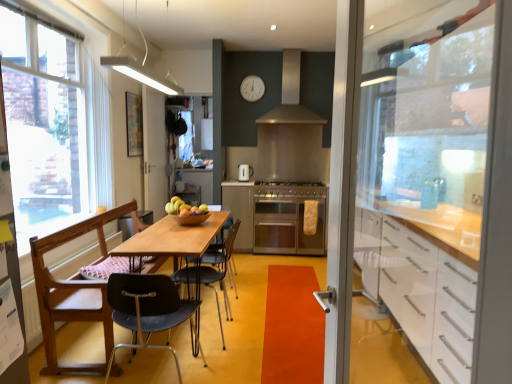
Image resolution: width=512 pixels, height=384 pixels. Describe the element at coordinates (52, 128) in the screenshot. I see `clear glass window at left` at that location.

Measure the distance between metallic silver kettle at center and camera.

The distance of metallic silver kettle at center from camera is 19.65 feet.

What do you see at coordinates (184, 208) in the screenshot?
I see `matte wooden bowl at center` at bounding box center [184, 208].

Describe the element at coordinates (431, 184) in the screenshot. I see `transparent glass screen door at right, the 2th screen door in the left-to-right sequence` at that location.

Locate an element on the screen. The height and width of the screenshot is (384, 512). satin silver exhaust hood at upper center is located at coordinates (292, 95).

Is orange matte door handle at center facing away from satin silver exhaust hood at upper center?

No.

Is orange matte door handle at center beside satin silver exhaust hood at upper center?

No, orange matte door handle at center is not with satin silver exhaust hood at upper center.

Does orange matte door handle at center appear on the left side of satin silver exhaust hood at upper center?

Yes, orange matte door handle at center is to the left of satin silver exhaust hood at upper center.

Between metallic silver kettle at center and satin silver exhaust hood at upper center, which one appears on the left side from the viewer's perspective?

metallic silver kettle at center.

Considering the positions of point (238, 167) and point (293, 95), is point (238, 167) closer or farther from the camera than point (293, 95)?

Point (238, 167) is closer to the camera than point (293, 95).

Is metallic silver kettle at center further to the viewer compared to satin silver exhaust hood at upper center?

Yes.

Can you confirm if metallic silver kettle at center is thinner than satin silver exhaust hood at upper center?

Indeed, metallic silver kettle at center has a lesser width compared to satin silver exhaust hood at upper center.

Can you tell me how much clear glass window at left and wooden chair at left, which is counted as the second chair, starting from the front, differ in facing direction?

The angle between the facing direction of clear glass window at left and the facing direction of wooden chair at left, which is counted as the second chair, starting from the front, is 0.717 degrees.

Find the location of a particular element. This screenshot has width=512, height=384. window on the left side of wooden chair at left, which is counted as the second chair, starting from the front is located at coordinates (52, 128).

Is clear glass window at left closer to camera compared to wooden chair at left, which is counted as the 2th chair, starting from the back?

No, the depth of clear glass window at left is greater than that of wooden chair at left, which is counted as the 2th chair, starting from the back.

Considering the positions of points (10, 123) and (35, 252), is point (10, 123) closer to camera compared to point (35, 252)?

No, it is behind (35, 252).

From a real-world perspective, is black plastic chair at center, positioned as the third chair in back-to-front order, below black plastic chair at center, the third chair in the front-to-back sequence?

Indeed, from a real-world perspective, black plastic chair at center, positioned as the third chair in back-to-front order, is positioned beneath black plastic chair at center, the third chair in the front-to-back sequence.

Is black plastic chair at center, the first chair when ordered from front to back, surrounding black plastic chair at center, the third chair in the front-to-back sequence?

No, black plastic chair at center, the first chair when ordered from front to back, does not contain black plastic chair at center, the third chair in the front-to-back sequence.

Between black plastic chair at center, the first chair when ordered from front to back, and black plastic chair at center, which is the 1th chair from back to front, which one has smaller size?

black plastic chair at center, which is the 1th chair from back to front.

Measure the distance between black plastic chair at center, positioned as the third chair in back-to-front order, and transparent glass screen door at center, acting as the first screen door starting from the back.

The distance of black plastic chair at center, positioned as the third chair in back-to-front order, from transparent glass screen door at center, acting as the first screen door starting from the back, is 9.25 feet.

Where is `the 2nd screen door above the black plastic chair at center, the first chair when ordered from front to back (from the image's perspective)`? the 2nd screen door above the black plastic chair at center, the first chair when ordered from front to back (from the image's perspective) is located at coordinates (154, 152).

Can you confirm if black plastic chair at center, the first chair when ordered from front to back, is positioned to the left of transparent glass screen door at center, the 2th screen door in the front-to-back sequence?

No, black plastic chair at center, the first chair when ordered from front to back, is not to the left of transparent glass screen door at center, the 2th screen door in the front-to-back sequence.

From a real-world perspective, is black plastic chair at center, positioned as the third chair in back-to-front order, positioned over transparent glass screen door at center, the 2th screen door in the front-to-back sequence, based on gravity?

No.

From their relative heights in the image, would you say stainless steel oven at center is taller or shorter than transparent glass screen door at center, acting as the first screen door starting from the back?

In the image, stainless steel oven at center appears to be shorter than transparent glass screen door at center, acting as the first screen door starting from the back.

Is stainless steel oven at center oriented towards transparent glass screen door at center, acting as the first screen door starting from the back?

No, stainless steel oven at center is not oriented towards transparent glass screen door at center, acting as the first screen door starting from the back.

From the image's perspective, between stainless steel oven at center and transparent glass screen door at center, the 2th screen door in the front-to-back sequence, who is located below?

stainless steel oven at center, from the image's perspective.

Starting from the stainless steel oven at center, which screen door is the 2nd one to the left? Please provide its 2D coordinates.

[(154, 152)]

Is orange matte door handle at center placed right next to matte wooden bowl at center?

No, orange matte door handle at center is not with matte wooden bowl at center.

From the image's perspective, is orange matte door handle at center over matte wooden bowl at center?

No.

Is orange matte door handle at center facing away from matte wooden bowl at center?

No, matte wooden bowl at center is not at the back of orange matte door handle at center.

Where is `exhaust hood that is on the right side of orange matte door handle at center`? The image size is (512, 384). exhaust hood that is on the right side of orange matte door handle at center is located at coordinates (292, 95).

Where is `kitchen appliance behind the satin silver exhaust hood at upper center`? This screenshot has height=384, width=512. kitchen appliance behind the satin silver exhaust hood at upper center is located at coordinates (245, 172).

From the image, which object appears to be farther from clear glass window at left, wooden bowl at table or satin silver gas stove at center?

Among the two, satin silver gas stove at center is located further to clear glass window at left.

Estimate the real-world distances between objects in this image. Which object is closer to matte wooden bowl at center, satin silver gas stove at center or stainless steel oven at center?

The object closer to matte wooden bowl at center is stainless steel oven at center.

Estimate the real-world distances between objects in this image. Which object is closer to wooden table at center, black plastic chair at center, which is the 1th chair from back to front, or metallic silver kettle at center?

A: black plastic chair at center, which is the 1th chair from back to front, is closer to wooden table at center.

Estimate the real-world distances between objects in this image. Which object is further from clear glass window at left, black plastic chair at center, the third chair in the front-to-back sequence, or wooden chair at left, which is counted as the second chair, starting from the front?

Based on the image, black plastic chair at center, the third chair in the front-to-back sequence, appears to be further to clear glass window at left.

Based on their spatial positions, is matte wooden bowl at center or matte white cabinet at center closer to wooden bowl at table?

Based on the image, matte wooden bowl at center appears to be nearer to wooden bowl at table.

When comparing their distances from orange matte door handle at center, does black plastic chair at center, positioned as the third chair in back-to-front order, or wooden bowl at table seem further?

wooden bowl at table lies further to orange matte door handle at center than the other object.

Looking at the image, which one is located further to matte wooden bowl at center, wooden table at center or metallic silver kettle at center?

Among the two, metallic silver kettle at center is located further to matte wooden bowl at center.

Based on their spatial positions, is transparent glass screen door at center, acting as the first screen door starting from the back, or white plastic clock at upper center further from orange matte door handle at center?

white plastic clock at upper center.

Where is `chair between wooden table at center and transparent glass screen door at center, the second screen door positioned from the right, in the front-back direction`? The width and height of the screenshot is (512, 384). chair between wooden table at center and transparent glass screen door at center, the second screen door positioned from the right, in the front-back direction is located at coordinates (213, 272).

The height and width of the screenshot is (384, 512). I want to click on exhaust hood between white plastic clock at upper center and satin silver gas stove at center in the up-down direction, so click(292, 95).

At what (x,y) coordinates should I click in order to perform the action: click on apple between wooden bowl at table and satin silver gas stove at center from front to back. Please return your answer as a coordinate pair (x, y). Looking at the image, I should click on (184, 208).

Locate an element on the screen. table between black plastic chair at center, positioned as the third chair in back-to-front order, and metallic silver kettle at center, along the z-axis is located at coordinates (174, 238).